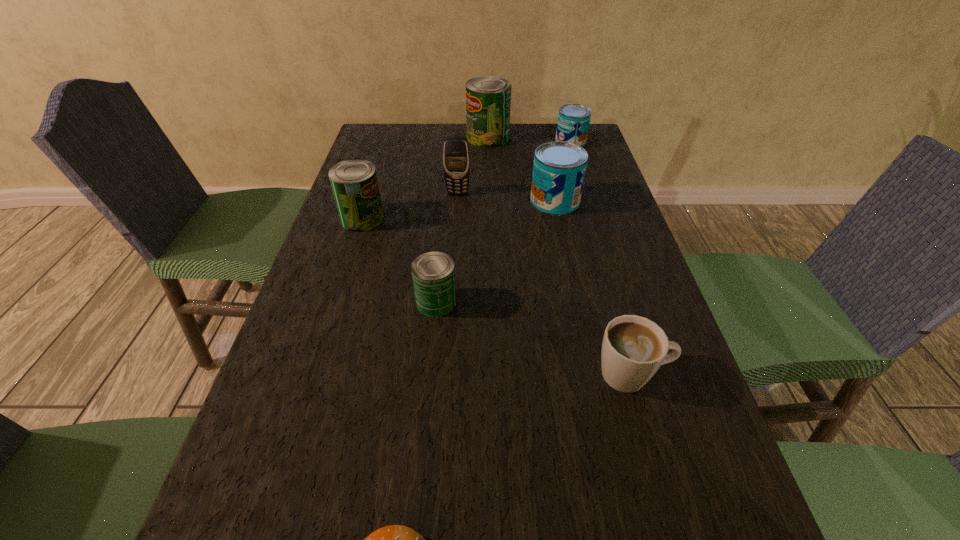
Where is `vacant space at the far edge of the desktop`? vacant space at the far edge of the desktop is located at coordinates (437, 153).

Find the location of a particular element. vacant space at the left edge of the desktop is located at coordinates (358, 265).

I want to click on free spot at the right edge of the desktop, so click(571, 225).

Where is `vacant space at the far left corner of the desktop`? Image resolution: width=960 pixels, height=540 pixels. vacant space at the far left corner of the desktop is located at coordinates (384, 125).

In order to click on free point between the second nearest object and the bigger blue can in this screenshot , I will do `click(593, 287)`.

The height and width of the screenshot is (540, 960). In order to click on empty location between the third nearest object and the smaller blue can in this screenshot , I will do `click(503, 222)`.

In order to click on vacant space in between the nearest green can and the cellular telephone in this screenshot , I will do `click(447, 248)`.

This screenshot has width=960, height=540. What are the coordinates of `vacant space that is in between the smaller blue can and the white cappuccino` in the screenshot? It's located at (601, 258).

Find the location of a particular element. vacant area between the white cappuccino and the leftmost object is located at coordinates (497, 296).

Identify the location of object that stands as the fourth closest to the farther blue can. (354, 182).